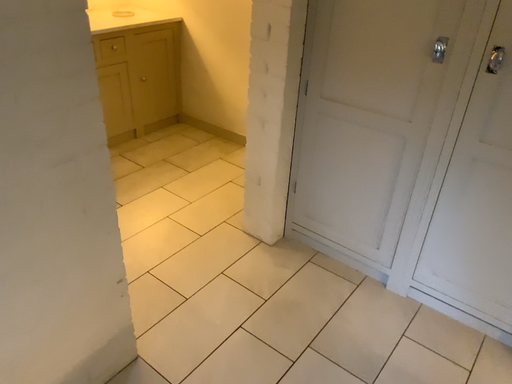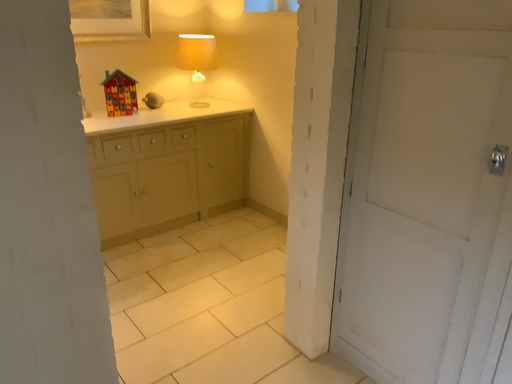
Question: How did the camera likely rotate when shooting the video?

Choices:
 (A) rotated right
 (B) rotated left

Answer: (B)